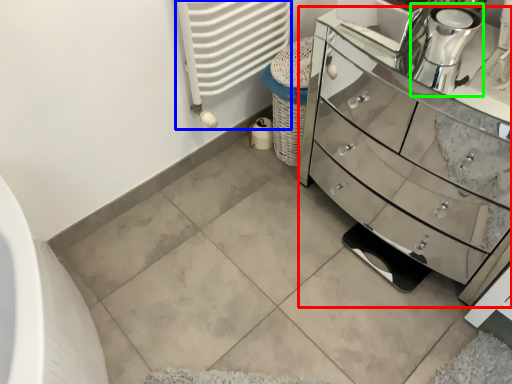
Question: Estimate the real-world distances between objects in this image. Which object is farther from chest of drawers (highlighted by a red box), radiator (highlighted by a blue box) or coffee machine (highlighted by a green box)?

Choices:
 (A) radiator
 (B) coffee machine

Answer: (B)